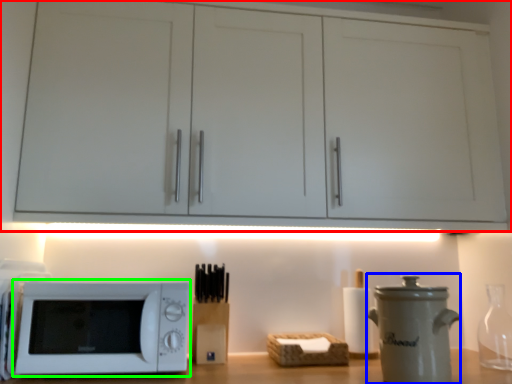
Question: Which object is positioned closest to cabinetry (highlighted by a red box)? Select from appliance (highlighted by a blue box) and microwave oven (highlighted by a green box).

Choices:
 (A) appliance
 (B) microwave oven

Answer: (B)